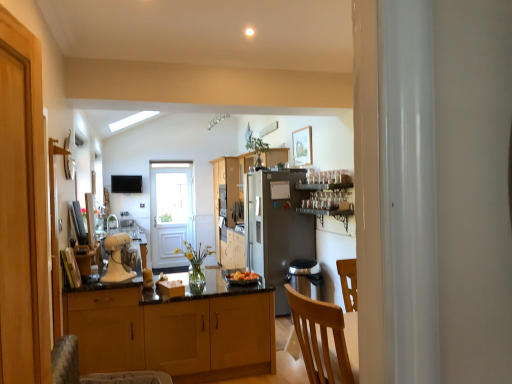
Question: From the image's perspective, is smooth orange fruit at center located above or below white glossy door at center?

Choices:
 (A) below
 (B) above

Answer: (A)

Question: From a real-world perspective, is smooth orange fruit at center positioned above or below white glossy door at center?

Choices:
 (A) below
 (B) above

Answer: (A)

Question: Which object is the farthest from the metallic glassware at center?

Choices:
 (A) translucent glass vase at center, the 1th houseplant when ordered from bottom to top
 (B) white matte stand mixer at center
 (C) white glossy door at center
 (D) wooden cabinets at center, the 3th cabinetry from the front
 (E) wooden cabinet at center, arranged as the second cabinetry when viewed from the front

Answer: (C)

Question: Estimate the real-world distances between objects in this image. Which object is farther from the white matte stand mixer at center?

Choices:
 (A) wooden framed picture at upper center
 (B) green leafy plant at upper center, arranged as the 1th houseplant when viewed from the back
 (C) matte black tv at upper center
 (D) satin silver refrigerator at center
 (E) wooden cabinets at center, the 3th cabinetry from the front

Answer: (C)